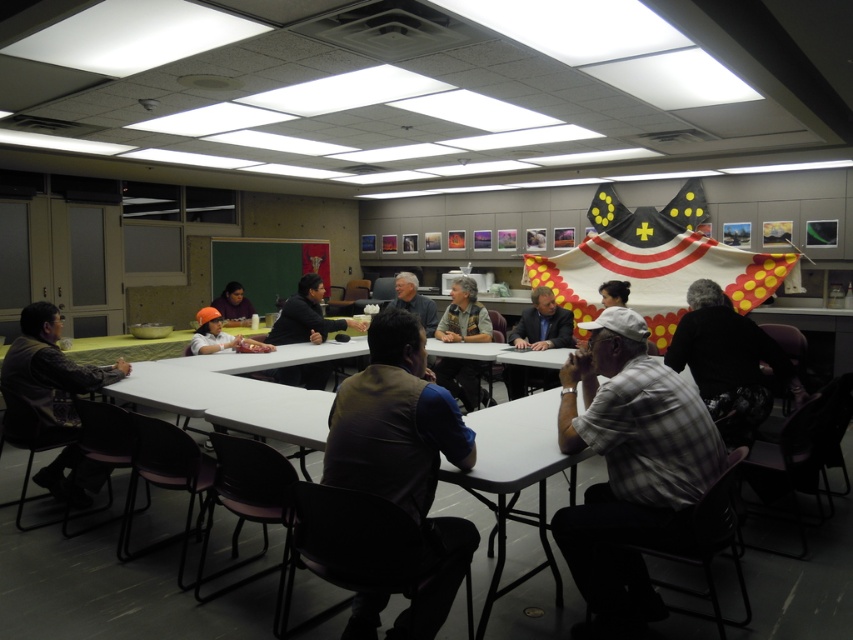
Question: Which point is closer to the camera?

Choices:
 (A) (651, 268)
 (B) (378, 452)

Answer: (B)

Question: Which point is closer to the camera?

Choices:
 (A) plaid shirt at center
 (B) white checkered shirt at center

Answer: (B)

Question: Does white checkered shirt at center have a greater width compared to yellow fabric flag at upper right?

Choices:
 (A) no
 (B) yes

Answer: (A)

Question: Can you confirm if plaid shirt at center is positioned below camouflage vest at center?

Choices:
 (A) yes
 (B) no

Answer: (A)

Question: Estimate the real-world distances between objects in this image. Which object is farther from the gray fabric vest at center?

Choices:
 (A) dark brown leather jacket at center
 (B) camouflage jacket at left

Answer: (B)

Question: Is the position of camouflage jacket at left less distant than that of gray fabric vest at center?

Choices:
 (A) no
 (B) yes

Answer: (B)